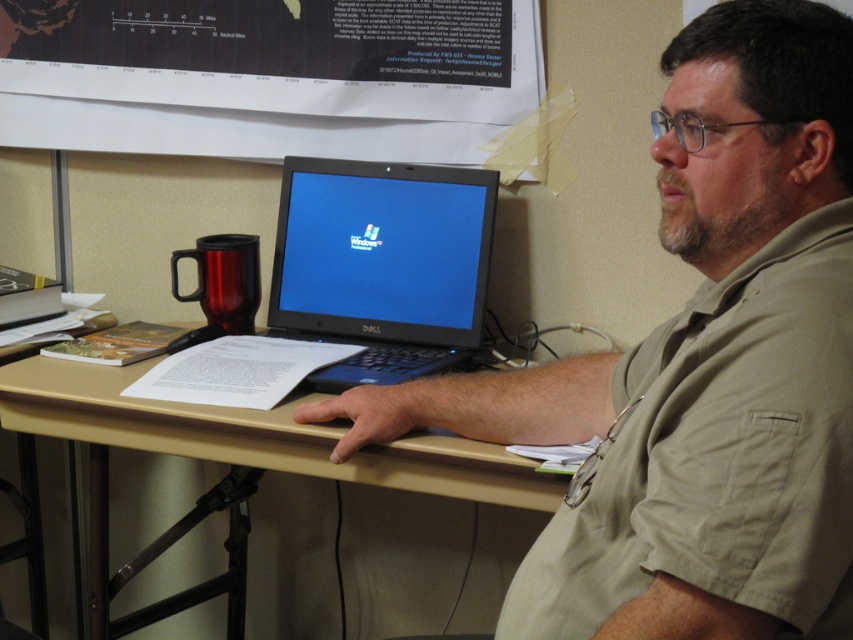
You are organizing a desk and need to place a new keyboard. The matte black laptop at center is currently on the beige wood computer desk at center. Where should you place the keyboard to ensure it is under the laptop?

The keyboard should be placed under the matte black laptop at center since it is positioned over the beige wood computer desk at center.

You are organizing a desk and need to place a new monitor that is 18 inches wide. Considering the black plastic laptop at center and the beige wood computer desk at center, will the desk have enough space for the monitor?

The black plastic laptop at center has a lesser width compared to beige wood computer desk at center, so the desk should have enough space to accommodate the 18 inch wide monitor.

You are an office assistant who needs to place a new document on the desk. The desk has limited space. The point at coordinates (268, 76) marks the location of the white paper at upper center. Where should you place the new document to avoid overlapping with existing items?

Place the new document away from the point at coordinates (268, 76) where the white paper at upper center is located to avoid overlapping with existing items.